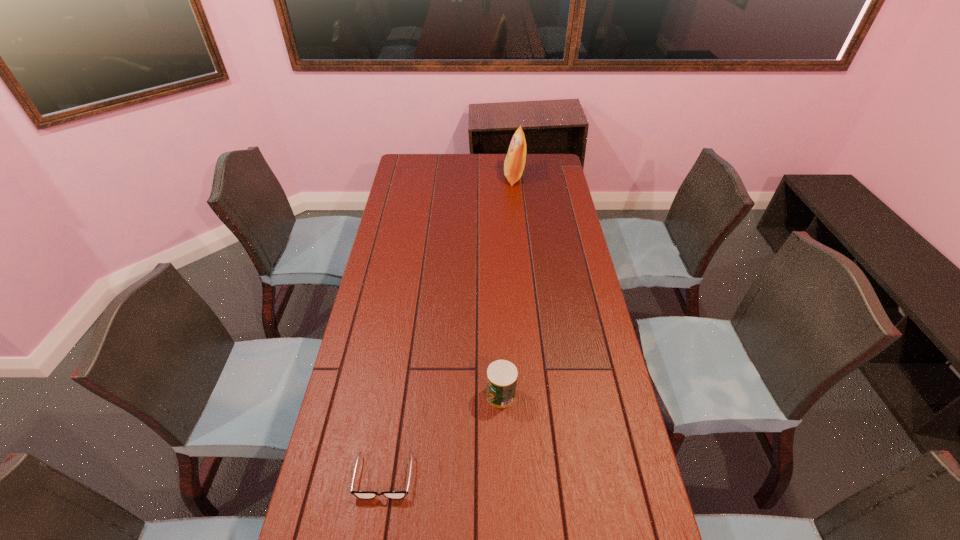
Locate an element on the screen. vacant area in the image that satisfies the following two spatial constraints: 1. on the front-facing side of the rightmost object; 2. on the front-facing side of the shortest object is located at coordinates (545, 477).

At what (x,y) coordinates should I click in order to perform the action: click on blank area in the image that satisfies the following two spatial constraints: 1. on the front-facing side of the tallest object; 2. on the front side of the second tallest object. Please return your answer as a coordinate pair (x, y). This screenshot has width=960, height=540. Looking at the image, I should click on (537, 395).